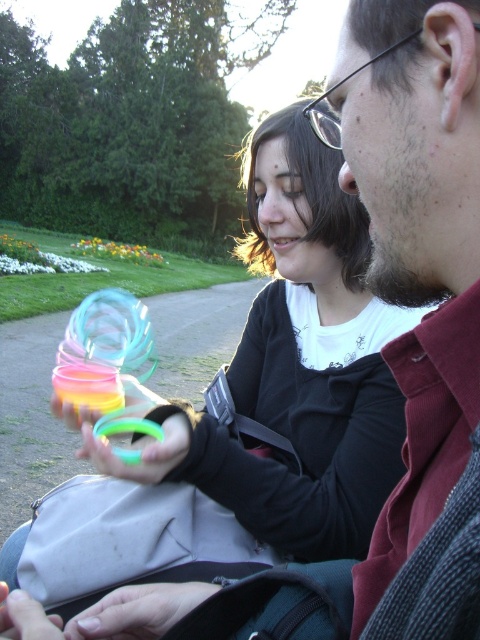
You are a photographer trying to capture the scene. You need to adjust your camera focus so that both the dark red shirt at right and the matte plastic ring at lower center are in focus. Given their relative sizes in the image, which object should you focus on to ensure both are sharp?

The dark red shirt at right is taller than the matte plastic ring at lower center, so focusing on the larger object will help ensure both are in focus.

You are standing in the image and want to touch the point at coordinates (417, 241). Which object will your finger land on?

The point at coordinates (417, 241) is located on the dark red shirt at right.